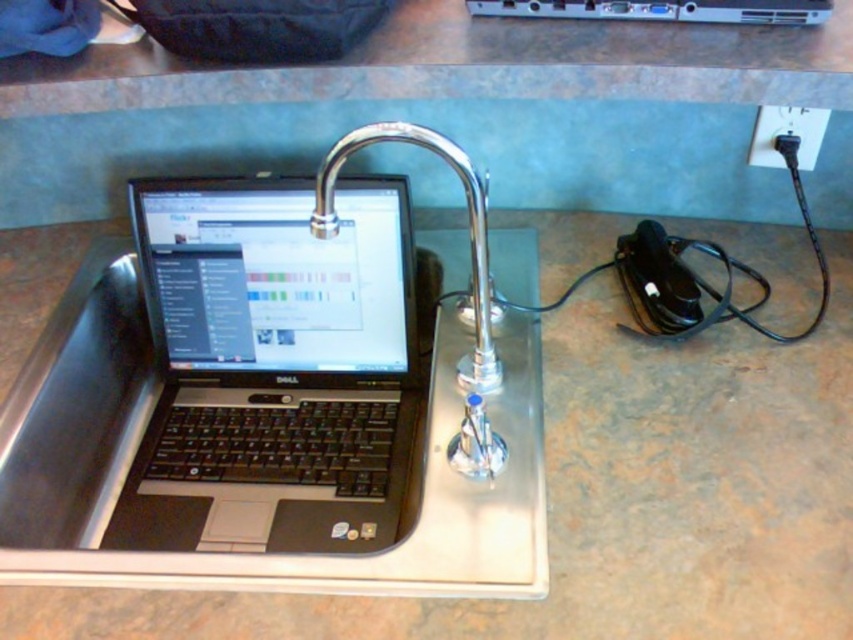
Question: Which of the following is the closest to the observer?

Choices:
 (A) stainless steel sink at left
 (B) black matte laptop at left

Answer: (A)

Question: Which object appears farthest from the camera in this image?

Choices:
 (A) stainless steel sink at left
 (B) black matte laptop at left
 (C) metallic silver computer at upper center

Answer: (B)

Question: Can you confirm if satin nickel faucet at center is wider than metallic silver computer at upper center?

Choices:
 (A) yes
 (B) no

Answer: (B)

Question: Which object is farther from the camera taking this photo?

Choices:
 (A) satin nickel faucet at center
 (B) black plastic plug at upper right
 (C) metallic silver computer at upper center

Answer: (C)

Question: Does satin nickel faucet at center have a smaller size compared to metallic silver computer at upper center?

Choices:
 (A) yes
 (B) no

Answer: (B)

Question: Can you confirm if metallic silver computer at upper center is wider than black plastic plug at upper right?

Choices:
 (A) yes
 (B) no

Answer: (A)